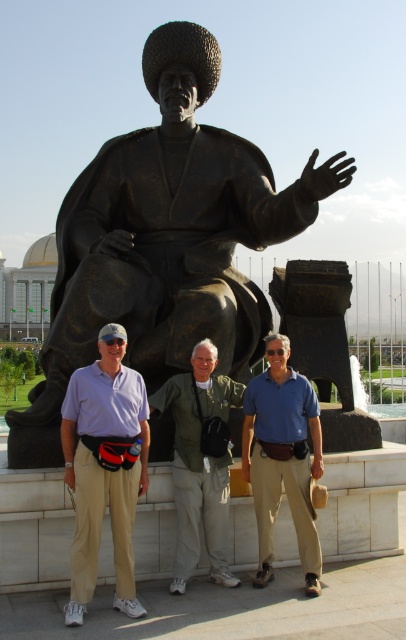
You are a photographer trying to capture a photo of the matte black statue at center. However, the blue cotton shirt at center is blocking your view. Can you estimate whether the statue is taller than the shirt? Use the scene description to help you decide.

The matte black statue at center is much taller than the blue cotton shirt at center, so the statue is taller and likely extends above the shirt, allowing you to adjust your angle to capture it without obstruction.

You are a photographer trying to capture a group photo of the matte black statue at center and the blue cotton shirt at center. If your camera has a maximum focus range of 4 meters, will you be able to capture both subjects clearly in the same frame?

The distance between the matte black statue at center and the blue cotton shirt at center is 4.55 meters. Since the camera can only focus up to 4 meters, it will not be able to capture both subjects clearly in the same frame because the distance exceeds the maximum focus range.

You are a photographer trying to capture the bronze statue at center and the blue cotton shirt at center in the same frame. Which object should you focus on first to ensure both are in the frame?

The bronze statue at center is bigger than the blue cotton shirt at center, so you should focus on the bronze statue at center first to ensure both are in the frame.